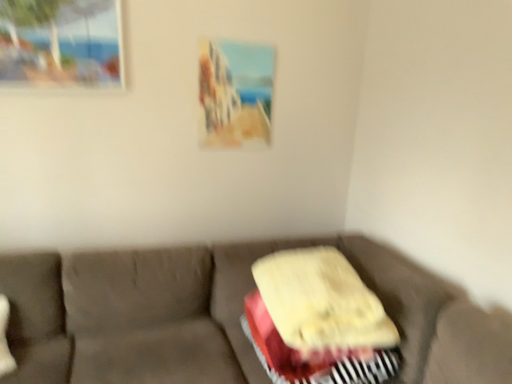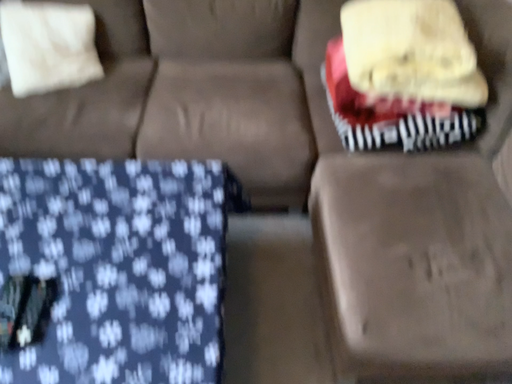
Question: How did the camera likely rotate when shooting the video?

Choices:
 (A) rotated downward
 (B) rotated upward

Answer: (A)